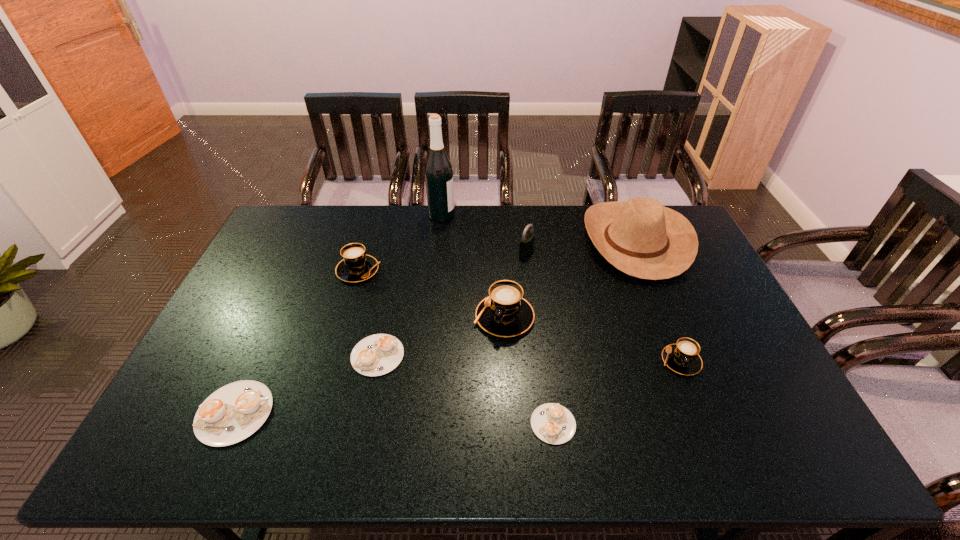
Find the location of a particular element. object that is at the left edge is located at coordinates (232, 413).

Locate an element on the screen. This screenshot has width=960, height=540. object positioned at the right edge is located at coordinates (640, 237).

At what (x,y) coordinates should I click in order to perform the action: click on object that is at the near left corner. Please return your answer as a coordinate pair (x, y). Looking at the image, I should click on (232, 413).

Where is `object at the far right corner`? The width and height of the screenshot is (960, 540). object at the far right corner is located at coordinates (640, 237).

Find the location of a particular element. The width and height of the screenshot is (960, 540). free region at the far edge of the desktop is located at coordinates (543, 235).

Locate an element on the screen. blank space at the left edge of the desktop is located at coordinates (281, 290).

In the image, there is a desktop. What are the coordinates of `free region at the near left corner` in the screenshot? It's located at (178, 441).

Find the location of a particular element. free space at the near right corner is located at coordinates (754, 430).

Where is `free space that is in between the padlock and the eighth shortest object`? This screenshot has height=540, width=960. free space that is in between the padlock and the eighth shortest object is located at coordinates (581, 246).

Find the location of `empty location between the farthest black cappuccino and the rightmost white cappuccino`. empty location between the farthest black cappuccino and the rightmost white cappuccino is located at coordinates (456, 347).